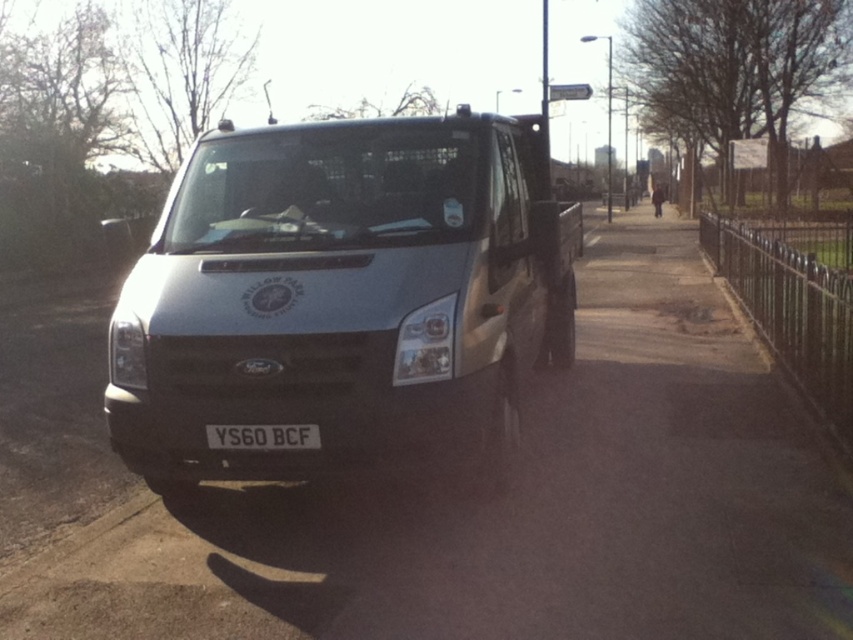
Question: Can you confirm if silver metallic van at center is positioned below black plastic license plate at center?

Choices:
 (A) yes
 (B) no

Answer: (B)

Question: Can you confirm if silver metallic van at center is positioned to the right of black plastic license plate at center?

Choices:
 (A) no
 (B) yes

Answer: (B)

Question: From the image, what is the correct spatial relationship of silver metallic van at center in relation to black plastic license plate at center?

Choices:
 (A) right
 (B) left

Answer: (A)